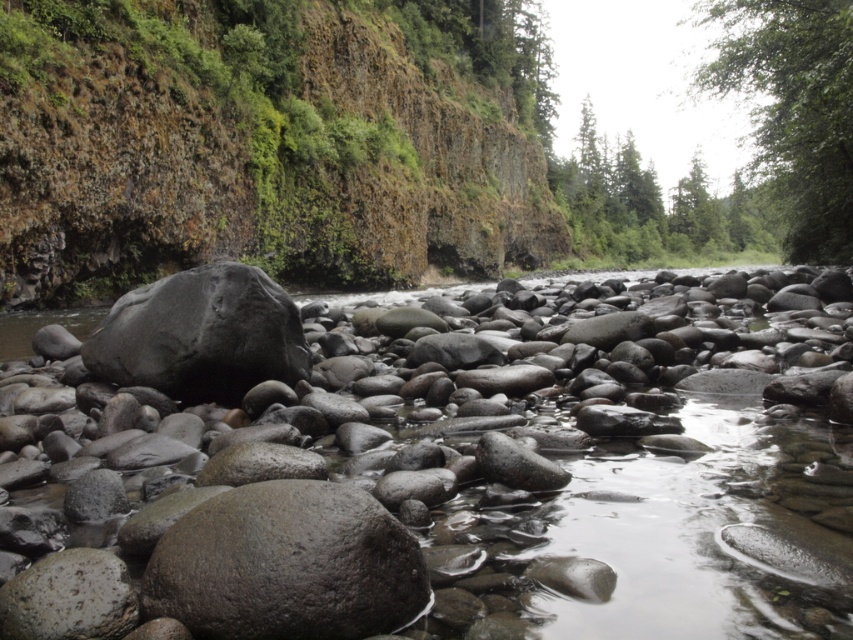
Question: Among these objects, which one is nearest to the camera?

Choices:
 (A) smooth gray rock at center
 (B) green matte tree at upper center
 (C) green mossy rock at left

Answer: (A)

Question: Does green mossy rock at left have a lesser width compared to green leafy tree at upper right?

Choices:
 (A) no
 (B) yes

Answer: (B)

Question: Does green mossy rock at left appear over green leafy tree at upper right?

Choices:
 (A) yes
 (B) no

Answer: (B)

Question: Which object is the closest to the green leafy tree at upper right?

Choices:
 (A) green matte tree at upper center
 (B) smooth gray rock at center

Answer: (B)

Question: Considering the real-world distances, which object is farthest from the green mossy rock at left?

Choices:
 (A) smooth gray rock at center
 (B) green leafy tree at upper right
 (C) green matte tree at upper center

Answer: (C)

Question: Is smooth gray rock at center to the right of green leafy tree at upper right from the viewer's perspective?

Choices:
 (A) yes
 (B) no

Answer: (B)